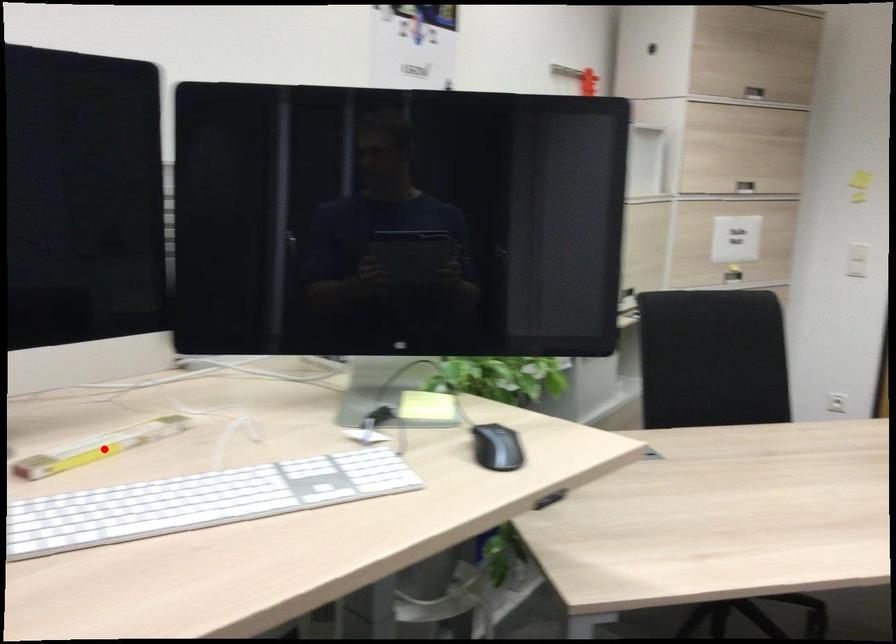
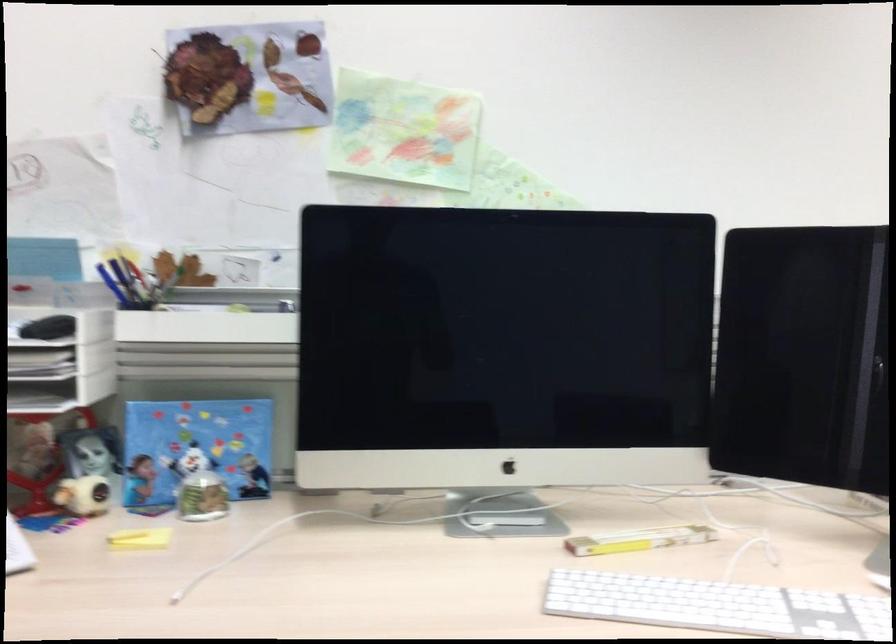
Question: I am providing you with two images of the same scene from different viewpoints. Image1 has a red point marked. In image2, the corresponding 3D location appears at what relative position? Reply with the corresponding letter.

Choices:
 (A) Closer
 (B) Farther

Answer: (B)